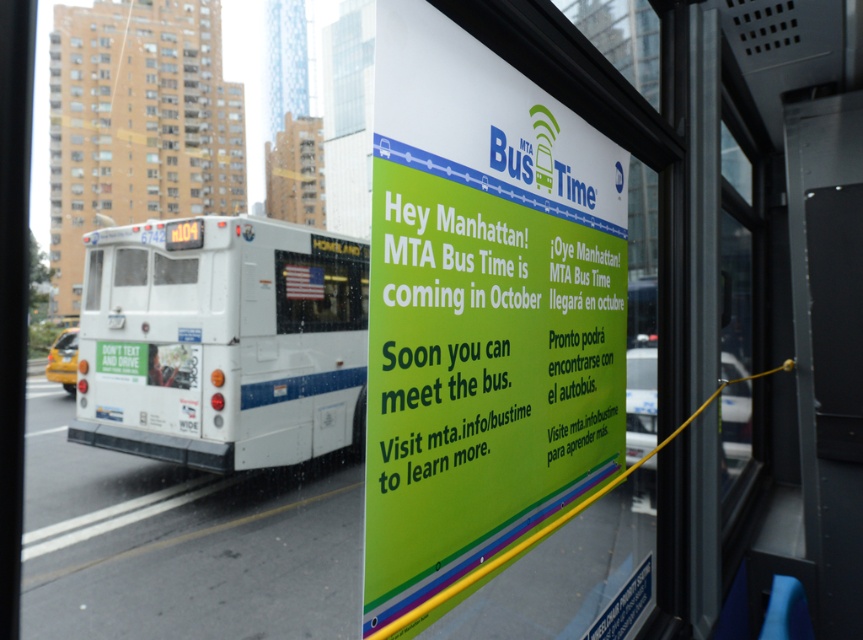
Who is taller, green matte poster at center or white matte bus at upper left?

white matte bus at upper left is taller.

Which is more to the right, green matte poster at center or white matte bus at upper left?

From the viewer's perspective, green matte poster at center appears more on the right side.

Who is more distant from viewer, (490, 342) or (153, 125)?

The point (153, 125) is behind.

I want to click on green matte poster at center, so click(490, 348).

Between white glossy bus at left and white matte bus at upper left, which one is positioned higher?

white matte bus at upper left is above.

Is point (205, 385) less distant than point (181, 179)?

Yes, point (205, 385) is closer to viewer.

Locate an element on the screen. Image resolution: width=863 pixels, height=640 pixels. white glossy bus at left is located at coordinates click(222, 342).

Can you confirm if white glossy bus at left is positioned below reflective glass american flag at center?

Indeed, white glossy bus at left is positioned under reflective glass american flag at center.

Does white glossy bus at left appear over reflective glass american flag at center?

No.

At what (x,y) coordinates should I click in order to perform the action: click on white glossy bus at left. Please return your answer as a coordinate pair (x, y). The width and height of the screenshot is (863, 640). Looking at the image, I should click on click(x=222, y=342).

Find the location of a particular element. white glossy bus at left is located at coordinates (222, 342).